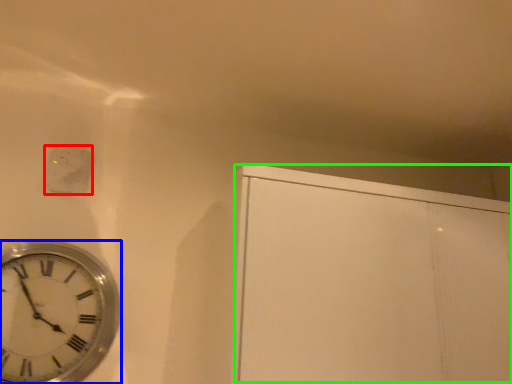
Question: Which is farther away from electric outlet (highlighted by a red box)? wall clock (highlighted by a blue box) or glass door (highlighted by a green box)?

Choices:
 (A) wall clock
 (B) glass door

Answer: (B)